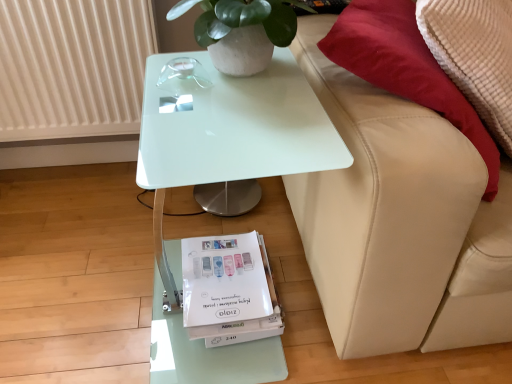
This screenshot has height=384, width=512. Identify the location of free space above white glossy table at center (from a real-world perspective). (228, 101).